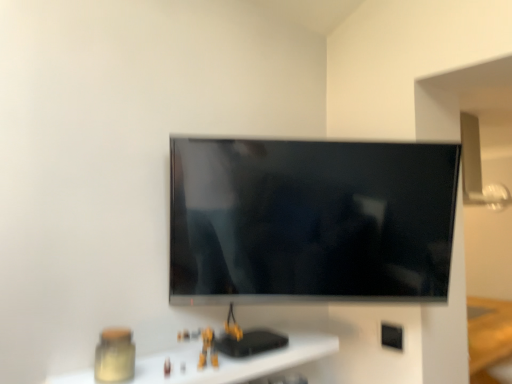
In order to click on matte glass jar at lower left in this screenshot , I will do `click(231, 362)`.

The width and height of the screenshot is (512, 384). What do you see at coordinates (392, 336) in the screenshot? I see `black plastic electric outlet at lower right` at bounding box center [392, 336].

In order to face flat screen tv at center, should I rotate leftwards or rightwards?

A 7.801 degree turn to the right will do.

I want to click on matte glass jar at lower left, so click(x=231, y=362).

From the image's perspective, which one is positioned higher, matte glass jar at lower left or flat screen tv at center?

flat screen tv at center.

Does matte glass jar at lower left lie behind flat screen tv at center?

No, matte glass jar at lower left is in front of flat screen tv at center.

In terms of width, does matte glass jar at lower left look wider or thinner when compared to flat screen tv at center?

Considering their sizes, matte glass jar at lower left looks broader than flat screen tv at center.

Which is in front, point (392, 326) or point (240, 188)?

The point (240, 188) is closer.

Considering the sizes of objects black plastic electric outlet at lower right and flat screen tv at center in the image provided, who is taller, black plastic electric outlet at lower right or flat screen tv at center?

With more height is flat screen tv at center.

Do you think black plastic electric outlet at lower right is within flat screen tv at center, or outside of it?

black plastic electric outlet at lower right is not inside flat screen tv at center, it's outside.

Between point (400, 330) and point (269, 352), which one is positioned behind?

The point (400, 330) is farther.

Image resolution: width=512 pixels, height=384 pixels. I want to click on electric outlet above the matte glass jar at lower left (from a real-world perspective), so click(392, 336).

Is black plastic electric outlet at lower right closer to the viewer compared to matte glass jar at lower left?

That is False.

Can matte glass jar at lower left be found inside black plastic electric outlet at lower right?

No.

From the image's perspective, is flat screen tv at center over black plastic electric outlet at lower right?

Yes, from the image's perspective, flat screen tv at center is above black plastic electric outlet at lower right.

Is flat screen tv at center positioned far away from black plastic electric outlet at lower right?

flat screen tv at center is near black plastic electric outlet at lower right, not far away.

Where is `electric outlet that is below the flat screen tv at center (from the image's perspective)`? electric outlet that is below the flat screen tv at center (from the image's perspective) is located at coordinates (392, 336).

Is flat screen tv at center bigger or smaller than matte glass jar at lower left?

Clearly, flat screen tv at center is larger in size than matte glass jar at lower left.

Which is nearer, (303, 298) or (231, 372)?

Point (303, 298) appears to be farther away from the viewer than point (231, 372).

Where is `television on the right of the matte glass jar at lower left`? The image size is (512, 384). television on the right of the matte glass jar at lower left is located at coordinates (311, 220).

Is flat screen tv at center spatially inside matte glass jar at lower left, or outside of it?

flat screen tv at center is not inside matte glass jar at lower left, it's outside.

Considering the relative sizes of matte glass jar at lower left and black plastic electric outlet at lower right in the image provided, is matte glass jar at lower left bigger than black plastic electric outlet at lower right?

Indeed, matte glass jar at lower left has a larger size compared to black plastic electric outlet at lower right.

How different are the orientations of matte glass jar at lower left and black plastic electric outlet at lower right in degrees?

They differ by 93 degrees in their facing directions.

In the image, there is a matte glass jar at lower left. Identify the location of electric outlet below it (from the image's perspective). The image size is (512, 384). pyautogui.click(x=392, y=336).

From a real-world perspective, is matte glass jar at lower left above or below black plastic electric outlet at lower right?

From a real-world perspective, matte glass jar at lower left is physically below black plastic electric outlet at lower right.

Where is `furniture below the flat screen tv at center (from a real-world perspective)`? furniture below the flat screen tv at center (from a real-world perspective) is located at coordinates (231, 362).

At what (x,y) coordinates should I click in order to perform the action: click on electric outlet below the flat screen tv at center (from the image's perspective). Please return your answer as a coordinate pair (x, y). Looking at the image, I should click on (392, 336).

From the image, which object appears to be farther from black plastic electric outlet at lower right, flat screen tv at center or matte glass jar at lower left?

Among the two, flat screen tv at center is located further to black plastic electric outlet at lower right.

Estimate the real-world distances between objects in this image. Which object is further from black plastic electric outlet at lower right, matte glass jar at lower left or flat screen tv at center?

The object further to black plastic electric outlet at lower right is flat screen tv at center.

Estimate the real-world distances between objects in this image. Which object is closer to matte glass jar at lower left, flat screen tv at center or black plastic electric outlet at lower right?

The object closer to matte glass jar at lower left is flat screen tv at center.

Estimate the real-world distances between objects in this image. Which object is further from flat screen tv at center, black plastic electric outlet at lower right or matte glass jar at lower left?

Among the two, black plastic electric outlet at lower right is located further to flat screen tv at center.

From the picture: Considering their positions, is black plastic electric outlet at lower right positioned closer to matte glass jar at lower left than flat screen tv at center?

Among the two, flat screen tv at center is located nearer to matte glass jar at lower left.

Consider the image. Which object lies nearer to the anchor point flat screen tv at center, matte glass jar at lower left or black plastic electric outlet at lower right?

The object closer to flat screen tv at center is matte glass jar at lower left.

In order to click on television between matte glass jar at lower left and black plastic electric outlet at lower right from front to back in this screenshot , I will do `click(311, 220)`.